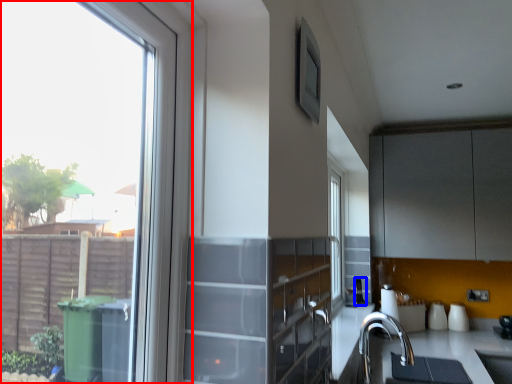
Question: Among these objects, which one is nearest to the camera, window (highlighted by a red box) or appliance (highlighted by a blue box)?

Choices:
 (A) window
 (B) appliance

Answer: (A)